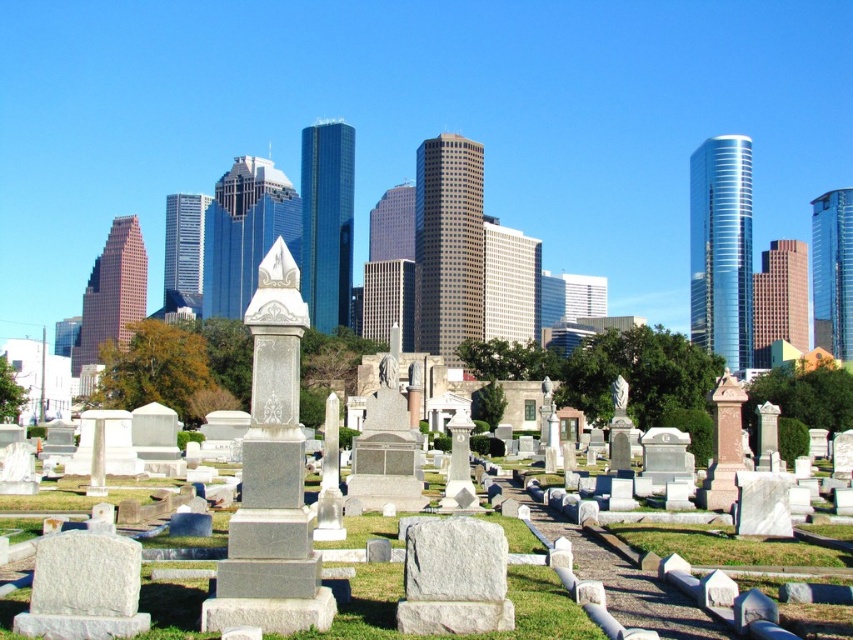
You are a gardener assessing the cemetery layout. You notice the green grass at center and the gray stone gravestone at center. Which object is taller in this scene?

The green grass at center is taller than the gray stone gravestone at center.